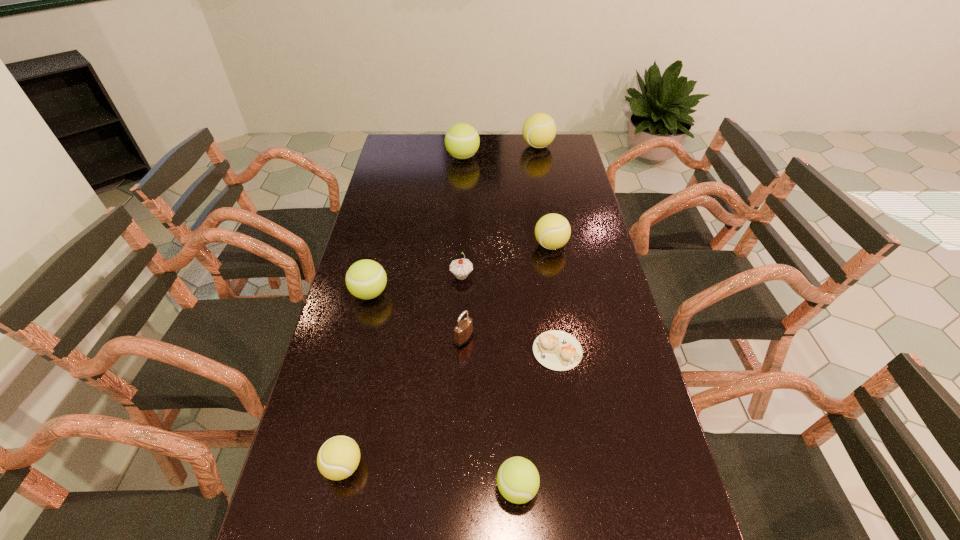
This screenshot has height=540, width=960. I want to click on vacant space at the far right corner of the desktop, so click(569, 135).

Identify the location of vacant area between the leftmost green tennis ball and the cupcake. The image size is (960, 540). (416, 285).

Locate an element on the screen. The height and width of the screenshot is (540, 960). empty space that is in between the leftmost yellow tennis ball and the padlock is located at coordinates (403, 403).

Locate an element on the screen. vacant space that is in between the farthest green tennis ball and the padlock is located at coordinates (464, 248).

Locate an element on the screen. The height and width of the screenshot is (540, 960). free space between the biggest yellow tennis ball and the farthest green tennis ball is located at coordinates (500, 152).

Where is `unoccupied area between the leftmost yellow tennis ball and the gray cupcake`? unoccupied area between the leftmost yellow tennis ball and the gray cupcake is located at coordinates click(x=402, y=371).

I want to click on free space between the farthest green tennis ball and the fourth tennis ball from left to right, so click(x=490, y=322).

Find the location of a particular element. The image size is (960, 540). free space between the nearest green tennis ball and the white cappuccino is located at coordinates (538, 420).

Image resolution: width=960 pixels, height=540 pixels. In order to click on free space between the third tennis ball from right to left and the farthest yellow tennis ball in this screenshot , I will do `click(527, 317)`.

Identify the location of vacant space that's between the farthest yellow tennis ball and the nearest yellow tennis ball. Image resolution: width=960 pixels, height=540 pixels. (441, 306).